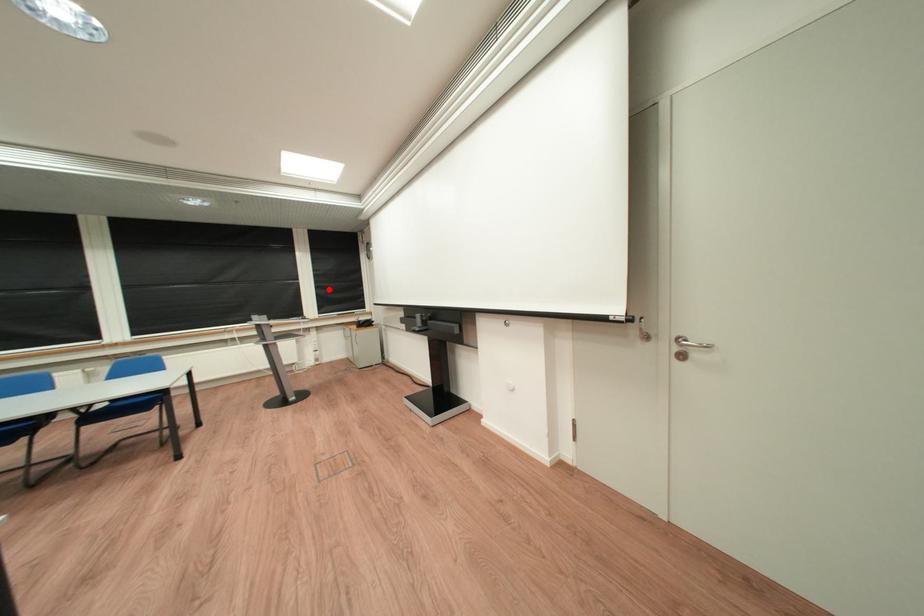
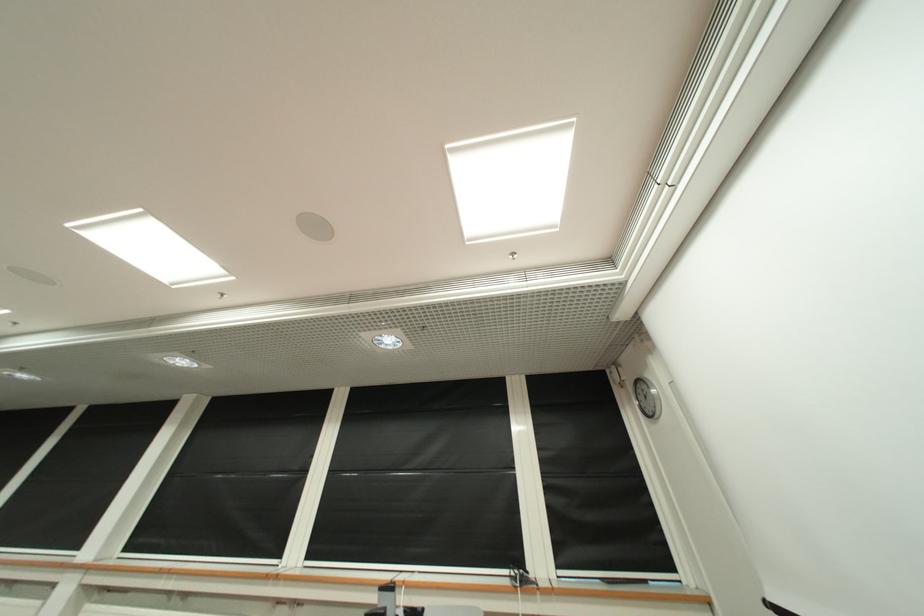
Question: I am providing you with two images of the same scene from different viewpoints. Given a red point in image1, look at the same physical point in image2. Is it:

Choices:
 (A) Closer to the viewpoint
 (B) Farther from the viewpoint

Answer: (B)